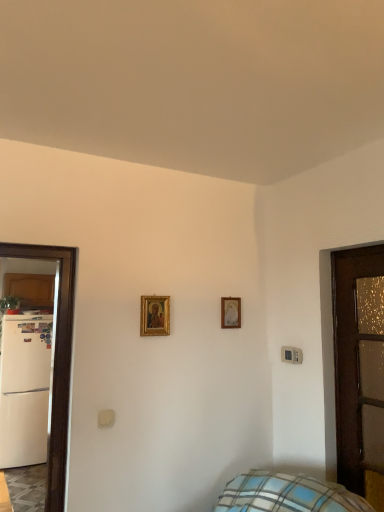
Question: Is gold-framed painting at center, which is the 1th picture frame in front-to-back order, looking in the opposite direction of gold-framed picture at center, arranged as the 1th picture frame when viewed from the back?

Choices:
 (A) yes
 (B) no

Answer: (B)

Question: Is gold-framed painting at center, marked as the 1th picture frame in a left-to-right arrangement, behind gold-framed picture at center, arranged as the 1th picture frame when viewed from the back?

Choices:
 (A) yes
 (B) no

Answer: (B)

Question: Is gold-framed painting at center, marked as the 1th picture frame in a left-to-right arrangement, at the right side of gold-framed picture at center, arranged as the second picture frame when viewed from the front?

Choices:
 (A) no
 (B) yes

Answer: (A)

Question: Can you confirm if gold-framed painting at center, which is the 1th picture frame in front-to-back order, is positioned to the left of gold-framed picture at center, arranged as the 1th picture frame when viewed from the back?

Choices:
 (A) yes
 (B) no

Answer: (A)

Question: From the image's perspective, is gold-framed painting at center, marked as the 1th picture frame in a left-to-right arrangement, beneath gold-framed picture at center, the 1th picture frame positioned from the right?

Choices:
 (A) yes
 (B) no

Answer: (B)

Question: Do you think gold-framed painting at center, marked as the 1th picture frame in a left-to-right arrangement, is within brown wooden door at right, or outside of it?

Choices:
 (A) outside
 (B) inside

Answer: (A)

Question: Based on their sizes in the image, would you say gold-framed painting at center, positioned as the 2th picture frame in back-to-front order, is bigger or smaller than brown wooden door at right?

Choices:
 (A) big
 (B) small

Answer: (B)

Question: From the image's perspective, is gold-framed painting at center, marked as the 1th picture frame in a left-to-right arrangement, located above or below brown wooden door at right?

Choices:
 (A) below
 (B) above

Answer: (B)

Question: Considering the positions of gold-framed painting at center, marked as the 1th picture frame in a left-to-right arrangement, and brown wooden door at right in the image, is gold-framed painting at center, marked as the 1th picture frame in a left-to-right arrangement, taller or shorter than brown wooden door at right?

Choices:
 (A) short
 (B) tall

Answer: (A)

Question: Is gold-framed painting at center, marked as the 1th picture frame in a left-to-right arrangement, situated inside white matte refrigerator at left or outside?

Choices:
 (A) inside
 (B) outside

Answer: (B)

Question: Visually, is gold-framed painting at center, which is the 1th picture frame in front-to-back order, positioned to the left or to the right of white matte refrigerator at left?

Choices:
 (A) right
 (B) left

Answer: (A)

Question: In terms of height, does gold-framed painting at center, which is the 1th picture frame in front-to-back order, look taller or shorter compared to white matte refrigerator at left?

Choices:
 (A) short
 (B) tall

Answer: (A)

Question: Considering the positions of gold-framed painting at center, marked as the 2th picture frame in a right-to-left arrangement, and white matte refrigerator at left in the image, is gold-framed painting at center, marked as the 2th picture frame in a right-to-left arrangement, bigger or smaller than white matte refrigerator at left?

Choices:
 (A) big
 (B) small

Answer: (B)

Question: Is brown wooden door at right inside the boundaries of gold-framed picture at center, the 1th picture frame positioned from the right, or outside?

Choices:
 (A) outside
 (B) inside

Answer: (A)

Question: From the image's perspective, is brown wooden door at right located above or below gold-framed picture at center, the 2th picture frame viewed from the left?

Choices:
 (A) below
 (B) above

Answer: (A)